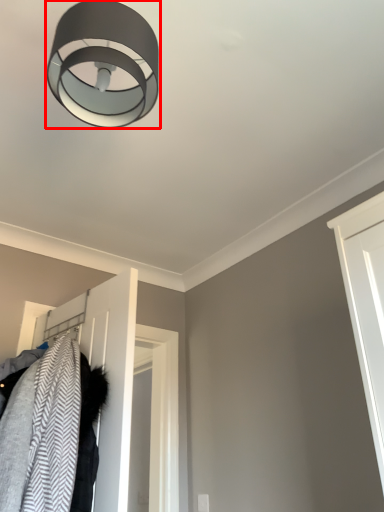
Question: From the image's perspective, where is lamp (annotated by the red box) located in relation to door in the image?

Choices:
 (A) below
 (B) above

Answer: (B)